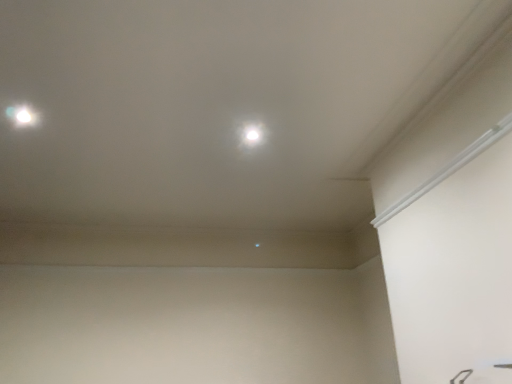
Question: Choose the correct answer: Is white glossy light at upper left, which is counted as the first dot, starting from the front, inside white glossy dot at center, the 1th dot in the bottom-to-top sequence, or outside it?

Choices:
 (A) outside
 (B) inside

Answer: (A)

Question: In terms of width, does white glossy light at upper left, which ranks as the 1th dot in left-to-right order, look wider or thinner when compared to white glossy dot at center, the 1th dot in the bottom-to-top sequence?

Choices:
 (A) wide
 (B) thin

Answer: (B)

Question: Is white glossy light at upper left, which ranks as the 1th dot in left-to-right order, bigger or smaller than white glossy dot at center, arranged as the first dot when viewed from the right?

Choices:
 (A) big
 (B) small

Answer: (B)

Question: Looking at their shapes, would you say white glossy dot at center, the first dot viewed from the back, is wider or thinner than white glossy light at upper left, which ranks as the 1th dot in left-to-right order?

Choices:
 (A) wide
 (B) thin

Answer: (A)

Question: Would you say white glossy dot at center, which ranks as the second dot in front-to-back order, is to the left or to the right of white glossy light at upper left, which ranks as the 1th dot in left-to-right order, in the picture?

Choices:
 (A) left
 (B) right

Answer: (B)

Question: Considering their positions, is white glossy dot at center, marked as the second dot in a left-to-right arrangement, located in front of or behind white glossy light at upper left, which ranks as the 1th dot in left-to-right order?

Choices:
 (A) front
 (B) behind

Answer: (B)

Question: From a real-world perspective, is white glossy dot at center, the first dot viewed from the back, above or below white glossy light at upper left, which is the 1th dot in top-to-bottom order?

Choices:
 (A) above
 (B) below

Answer: (A)